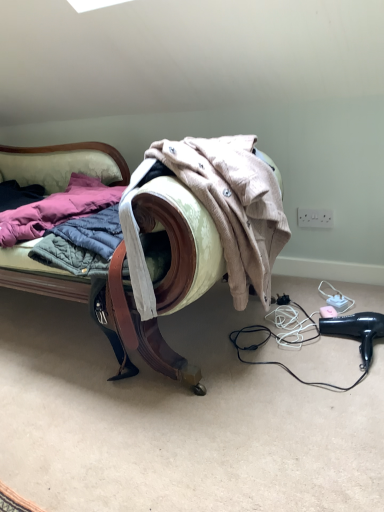
Question: Is wooden armchair at center to the left of black plastic hair dryer at lower right from the viewer's perspective?

Choices:
 (A) no
 (B) yes

Answer: (B)

Question: Is wooden armchair at center facing towards black plastic hair dryer at lower right?

Choices:
 (A) yes
 (B) no

Answer: (B)

Question: Is wooden armchair at center completely or partially outside of black plastic hair dryer at lower right?

Choices:
 (A) no
 (B) yes

Answer: (B)

Question: Would you say black plastic hair dryer at lower right is part of wooden armchair at center's contents?

Choices:
 (A) no
 (B) yes

Answer: (A)

Question: Considering the relative sizes of wooden armchair at center and black plastic hair dryer at lower right in the image provided, is wooden armchair at center thinner than black plastic hair dryer at lower right?

Choices:
 (A) no
 (B) yes

Answer: (A)

Question: From a real-world perspective, is wooden armchair at center positioned over black plastic hair dryer at lower right based on gravity?

Choices:
 (A) no
 (B) yes

Answer: (B)

Question: Is black plastic hair dryer at lower right aimed at wooden armchair at center?

Choices:
 (A) yes
 (B) no

Answer: (B)

Question: Is black plastic hair dryer at lower right thinner than wooden armchair at center?

Choices:
 (A) yes
 (B) no

Answer: (A)

Question: From the image's perspective, is black plastic hair dryer at lower right on wooden armchair at center?

Choices:
 (A) no
 (B) yes

Answer: (A)

Question: Is black plastic hair dryer at lower right turned away from wooden armchair at center?

Choices:
 (A) yes
 (B) no

Answer: (B)

Question: From the image's perspective, is black plastic hair dryer at lower right below wooden armchair at center?

Choices:
 (A) no
 (B) yes

Answer: (B)

Question: From a real-world perspective, is black plastic hair dryer at lower right positioned under wooden armchair at center based on gravity?

Choices:
 (A) no
 (B) yes

Answer: (B)

Question: Is black plastic hair dryer at lower right spatially inside wooden armchair at center, or outside of it?

Choices:
 (A) outside
 (B) inside

Answer: (A)